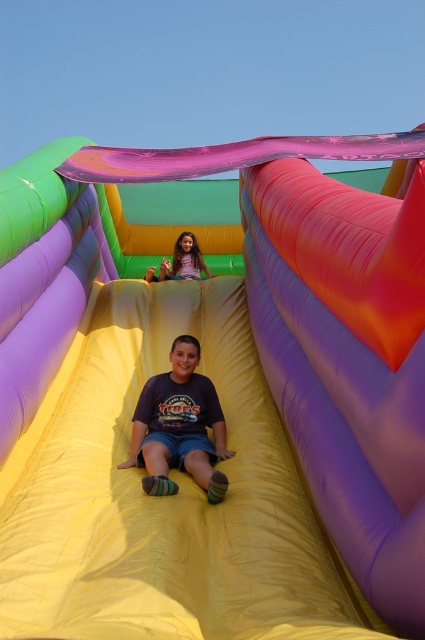
Which is behind, point (150, 445) or point (159, 266)?

Point (159, 266)

Which is in front, point (206, 378) or point (190, 243)?

Point (206, 378) is more forward.

This screenshot has width=425, height=640. I want to click on dark blue t-shirt at center, so click(180, 426).